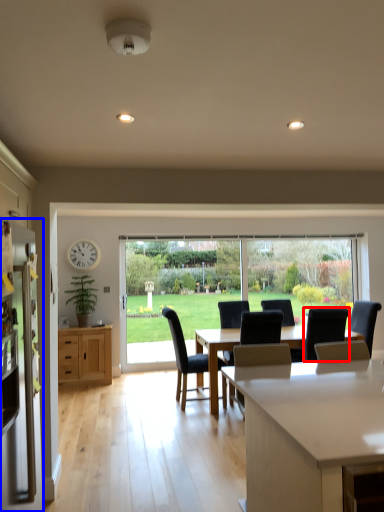
Question: Which point is closer to the camera, chair (highlighted by a red box) or refrigerator (highlighted by a blue box)?

Choices:
 (A) chair
 (B) refrigerator

Answer: (B)